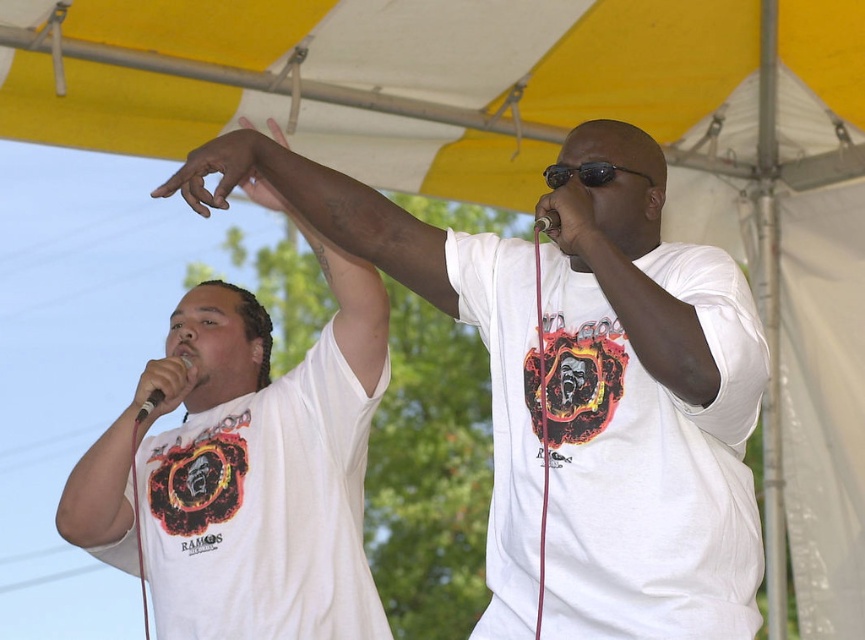
Question: Does white matte t-shirt at left have a larger size compared to white plastic microphone at upper left?

Choices:
 (A) yes
 (B) no

Answer: (A)

Question: From the image, what is the correct spatial relationship of white matte t-shirt at left in relation to white plastic microphone at upper left?

Choices:
 (A) above
 (B) below

Answer: (A)

Question: From the image, what is the correct spatial relationship of white matte t-shirt at left in relation to white plastic microphone at upper left?

Choices:
 (A) left
 (B) right

Answer: (B)

Question: Which of the following is the farthest from the observer?

Choices:
 (A) 138,422
 (B) 245,136

Answer: (A)

Question: Among these objects, which one is nearest to the camera?

Choices:
 (A) white matte t-shirt at left
 (B) white plastic microphone at upper left

Answer: (A)